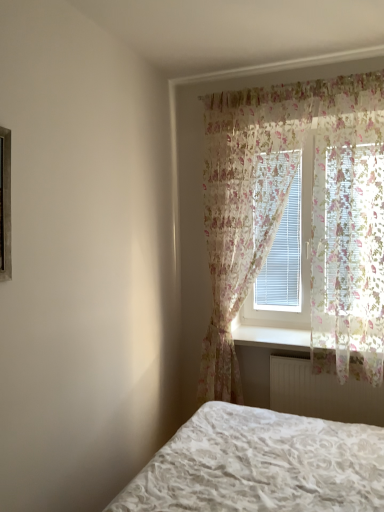
What do you see at coordinates (322, 393) in the screenshot? Image resolution: width=384 pixels, height=512 pixels. I see `white matte radiator at lower center` at bounding box center [322, 393].

Measure the distance between point (264, 337) and camera.

Point (264, 337) is 9.68 feet from camera.

The height and width of the screenshot is (512, 384). Find the location of `white matte radiator at lower center`. white matte radiator at lower center is located at coordinates (322, 393).

Considering the relative sizes of white plastic radiator at lower center and white matte radiator at lower center in the image provided, is white plastic radiator at lower center taller than white matte radiator at lower center?

In fact, white plastic radiator at lower center may be shorter than white matte radiator at lower center.

Considering the relative positions of white plastic radiator at lower center and white matte radiator at lower center in the image provided, is white plastic radiator at lower center in front of white matte radiator at lower center?

Yes, white plastic radiator at lower center is closer to the camera.

In the scene shown: Is white plastic radiator at lower center oriented towards white matte radiator at lower center?

No, white plastic radiator at lower center is not oriented towards white matte radiator at lower center.

Is white plastic radiator at lower center at the left side of white matte radiator at lower center?

Yes, white plastic radiator at lower center is to the left of white matte radiator at lower center.

Is the surface of floral sheer curtain at center, which appears as the 1th curtain when viewed from the left, in direct contact with white matte radiator at lower center?

They are not placed beside each other.

Is floral sheer curtain at center, which appears as the second curtain when viewed from the right, positioned with its back to white matte radiator at lower center?

No, white matte radiator at lower center is not at the back of floral sheer curtain at center, which appears as the second curtain when viewed from the right.

From the image's perspective, between floral sheer curtain at center, which appears as the second curtain when viewed from the right, and white matte radiator at lower center, which one is located above?

floral sheer curtain at center, which appears as the second curtain when viewed from the right, from the image's perspective.

Find the location of a particular element. curtain on the left of white matte radiator at lower center is located at coordinates (283, 210).

Considering the relative sizes of white matte radiator at lower center and floral sheer curtain at center, which appears as the second curtain when viewed from the right, in the image provided, is white matte radiator at lower center shorter than floral sheer curtain at center, which appears as the second curtain when viewed from the right,?

Yes.

Considering the positions of objects white matte radiator at lower center and floral sheer curtain at center, which appears as the 1th curtain when viewed from the left, in the image provided, who is more to the left, white matte radiator at lower center or floral sheer curtain at center, which appears as the 1th curtain when viewed from the left,?

floral sheer curtain at center, which appears as the 1th curtain when viewed from the left.

Could you measure the distance between white matte radiator at lower center and floral sheer curtain at center, which appears as the second curtain when viewed from the right?

The distance of white matte radiator at lower center from floral sheer curtain at center, which appears as the second curtain when viewed from the right, is 25.54 inches.

Are white matte radiator at lower center and floral sheer curtain at center, which appears as the second curtain when viewed from the right, making contact?

No, white matte radiator at lower center is not making contact with floral sheer curtain at center, which appears as the second curtain when viewed from the right.

Would you say floral sheer curtain at center, which appears as the 1th curtain when viewed from the left, contains white plastic radiator at lower center?

That's incorrect, white plastic radiator at lower center is not inside floral sheer curtain at center, which appears as the 1th curtain when viewed from the left.

Where is `the 1st curtain above the white plastic radiator at lower center (from a real-world perspective)`? the 1st curtain above the white plastic radiator at lower center (from a real-world perspective) is located at coordinates (283, 210).

Is floral sheer curtain at center, which appears as the 1th curtain when viewed from the left, aimed at white plastic radiator at lower center?

Yes, floral sheer curtain at center, which appears as the 1th curtain when viewed from the left, faces towards white plastic radiator at lower center.

Between floral sheer curtain at center, which appears as the second curtain when viewed from the right, and white plastic radiator at lower center, which one appears on the right side from the viewer's perspective?

white plastic radiator at lower center.

From a real-world perspective, is white matte radiator at lower center physically located above or below floral sheer curtain at upper right, which is counted as the second curtain, starting from the left?

From a real-world perspective, white matte radiator at lower center is physically below floral sheer curtain at upper right, which is counted as the second curtain, starting from the left.

Which object is positioned more to the left, white matte radiator at lower center or floral sheer curtain at upper right, which is counted as the second curtain, starting from the left?

From the viewer's perspective, white matte radiator at lower center appears more on the left side.

Is white matte radiator at lower center far away from floral sheer curtain at upper right, which is counted as the second curtain, starting from the left?

No.

Could you tell me if white matte radiator at lower center is turned towards floral sheer curtain at upper right, which is counted as the second curtain, starting from the left?

No, white matte radiator at lower center does not turn towards floral sheer curtain at upper right, which is counted as the second curtain, starting from the left.

How different are the orientations of floral sheer curtain at upper right, which is counted as the second curtain, starting from the left, and white plastic radiator at lower center in degrees?

The facing directions of floral sheer curtain at upper right, which is counted as the second curtain, starting from the left, and white plastic radiator at lower center are 0.542 degrees apart.

Which of these two, floral sheer curtain at upper right, which is counted as the second curtain, starting from the left, or white plastic radiator at lower center, is smaller?

With smaller size is white plastic radiator at lower center.

From the image's perspective, which one is positioned higher, floral sheer curtain at upper right, which is counted as the second curtain, starting from the left, or white plastic radiator at lower center?

From the image's view, floral sheer curtain at upper right, which is counted as the second curtain, starting from the left, is above.

From a real-world perspective, who is located lower, floral sheer curtain at upper right, arranged as the first curtain when viewed from the right, or white plastic radiator at lower center?

white plastic radiator at lower center, from a real-world perspective.

Could you tell me if floral sheer curtain at upper right, arranged as the first curtain when viewed from the right, is turned towards white matte radiator at lower center?

No, floral sheer curtain at upper right, arranged as the first curtain when viewed from the right, is not oriented towards white matte radiator at lower center.

Can you tell me how much floral sheer curtain at upper right, arranged as the first curtain when viewed from the right, and white matte radiator at lower center differ in facing direction?

The facing directions of floral sheer curtain at upper right, arranged as the first curtain when viewed from the right, and white matte radiator at lower center are 0.315 degrees apart.

Based on the photo, considering the sizes of objects floral sheer curtain at upper right, which is counted as the second curtain, starting from the left, and white matte radiator at lower center in the image provided, who is smaller, floral sheer curtain at upper right, which is counted as the second curtain, starting from the left, or white matte radiator at lower center?

white matte radiator at lower center is smaller.

From the picture: Does floral sheer curtain at upper right, which is counted as the second curtain, starting from the left, appear on the right side of white matte radiator at lower center?

Correct, you'll find floral sheer curtain at upper right, which is counted as the second curtain, starting from the left, to the right of white matte radiator at lower center.

You are a GUI agent. You are given a task and a screenshot of the screen. Output one action in this format:
    pyautogui.click(x=<x>, y=<y>)
    Task: Click on the window sill on the left side of white matte radiator at lower center
    
    Given the screenshot: What is the action you would take?
    point(271,337)

Locate an element on the screen. The width and height of the screenshot is (384, 512). the 1st curtain in front of the white matte radiator at lower center is located at coordinates (283, 210).

Based on their spatial positions, is white matte radiator at lower center or white plastic radiator at lower center further from floral sheer curtain at center, which appears as the 1th curtain when viewed from the left?

white plastic radiator at lower center.

Which object lies further to the anchor point floral sheer curtain at upper right, arranged as the first curtain when viewed from the right, white matte radiator at lower center or floral sheer curtain at center, which appears as the second curtain when viewed from the right?

white matte radiator at lower center lies further to floral sheer curtain at upper right, arranged as the first curtain when viewed from the right, than the other object.

Considering their positions, is white matte radiator at lower center positioned closer to floral sheer curtain at center, which appears as the 1th curtain when viewed from the left, than floral sheer curtain at upper right, arranged as the first curtain when viewed from the right?

Among the two, floral sheer curtain at upper right, arranged as the first curtain when viewed from the right, is located nearer to floral sheer curtain at center, which appears as the 1th curtain when viewed from the left.

Considering their positions, is floral sheer curtain at center, which appears as the second curtain when viewed from the right, positioned further to white matte radiator at lower center than white plastic radiator at lower center?

floral sheer curtain at center, which appears as the second curtain when viewed from the right, lies further to white matte radiator at lower center than the other object.

When comparing their distances from floral sheer curtain at center, which appears as the second curtain when viewed from the right, does white plastic radiator at lower center or floral sheer curtain at upper right, arranged as the first curtain when viewed from the right, seem closer?

Based on the image, floral sheer curtain at upper right, arranged as the first curtain when viewed from the right, appears to be nearer to floral sheer curtain at center, which appears as the second curtain when viewed from the right.

Considering their positions, is floral sheer curtain at upper right, which is counted as the second curtain, starting from the left, positioned further to white plastic radiator at lower center than white matte radiator at lower center?

floral sheer curtain at upper right, which is counted as the second curtain, starting from the left.

When comparing their distances from white plastic radiator at lower center, does white matte radiator at lower center or floral sheer curtain at center, which appears as the 1th curtain when viewed from the left, seem further?

floral sheer curtain at center, which appears as the 1th curtain when viewed from the left.

Estimate the real-world distances between objects in this image. Which object is closer to floral sheer curtain at center, which appears as the second curtain when viewed from the right, floral sheer curtain at upper right, arranged as the first curtain when viewed from the right, or white matte radiator at lower center?

The object closer to floral sheer curtain at center, which appears as the second curtain when viewed from the right, is floral sheer curtain at upper right, arranged as the first curtain when viewed from the right.

Find the location of a particular element. window sill between floral sheer curtain at upper right, which is counted as the second curtain, starting from the left, and white matte radiator at lower center from top to bottom is located at coordinates (271, 337).

Image resolution: width=384 pixels, height=512 pixels. What are the coordinates of `curtain that lies between floral sheer curtain at upper right, which is counted as the second curtain, starting from the left, and white matte radiator at lower center from top to bottom` in the screenshot? It's located at (283, 210).

In order to click on window sill that lies between floral sheer curtain at center, which appears as the 1th curtain when viewed from the left, and white matte radiator at lower center from top to bottom in this screenshot , I will do `click(271, 337)`.

Where is `curtain between floral sheer curtain at upper right, arranged as the first curtain when viewed from the right, and white plastic radiator at lower center from top to bottom`? The height and width of the screenshot is (512, 384). curtain between floral sheer curtain at upper right, arranged as the first curtain when viewed from the right, and white plastic radiator at lower center from top to bottom is located at coordinates (283, 210).